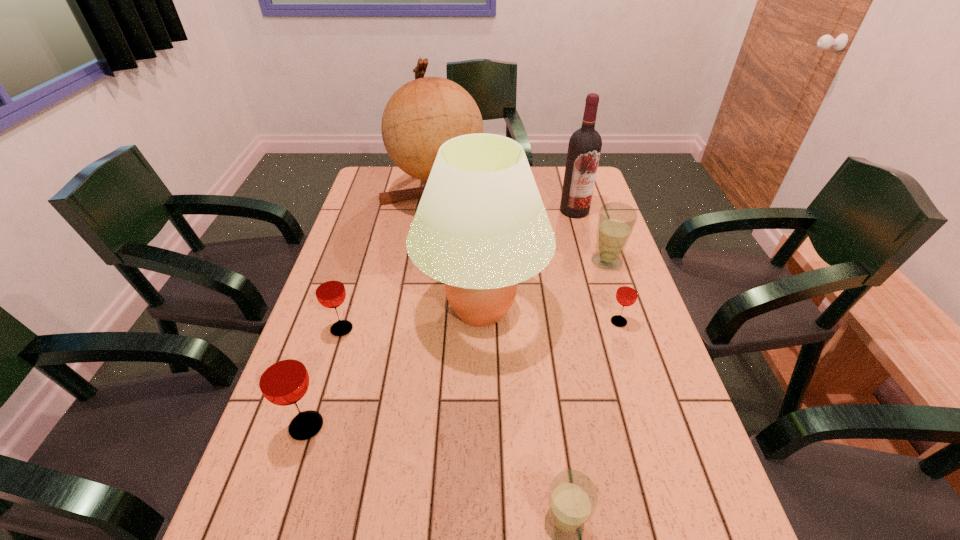
Find the location of a particular element. The height and width of the screenshot is (540, 960). free space located on the shade of the beige lampshade is located at coordinates [x=481, y=406].

You are a GUI agent. You are given a task and a screenshot of the screen. Output one action in this format:
    pyautogui.click(x=<x>, y=<y>)
    Task: Click on the blank area located on the label of the wine bottle
    The height and width of the screenshot is (540, 960).
    Given the screenshot: What is the action you would take?
    pyautogui.click(x=585, y=246)

Find the location of a particular element. Image resolution: width=960 pixels, height=540 pixels. vacant space located 0.110m on the right of the biggest red glass is located at coordinates (378, 426).

Locate an element on the screen. vacant space located on the front of the second smallest red glass is located at coordinates (309, 435).

This screenshot has height=540, width=960. What are the coordinates of `vacant space situated 0.050m on the front of the farther blue glass` in the screenshot? It's located at (614, 284).

At what (x,y) coordinates should I click in order to perform the action: click on vacant space situated 0.320m on the left of the smallest red glass. Please return your answer as a coordinate pair (x, y). This screenshot has width=960, height=540. Looking at the image, I should click on (488, 322).

Where is `object that is at the far edge`? Image resolution: width=960 pixels, height=540 pixels. object that is at the far edge is located at coordinates (423, 114).

At what (x,y) coordinates should I click in order to perform the action: click on globe located at the left edge. Please return your answer as a coordinate pair (x, y). Image resolution: width=960 pixels, height=540 pixels. Looking at the image, I should click on (423, 114).

Image resolution: width=960 pixels, height=540 pixels. Identify the location of wine bottle located at the right edge. (585, 144).

Find the location of a particular element. object present at the far left corner is located at coordinates (423, 114).